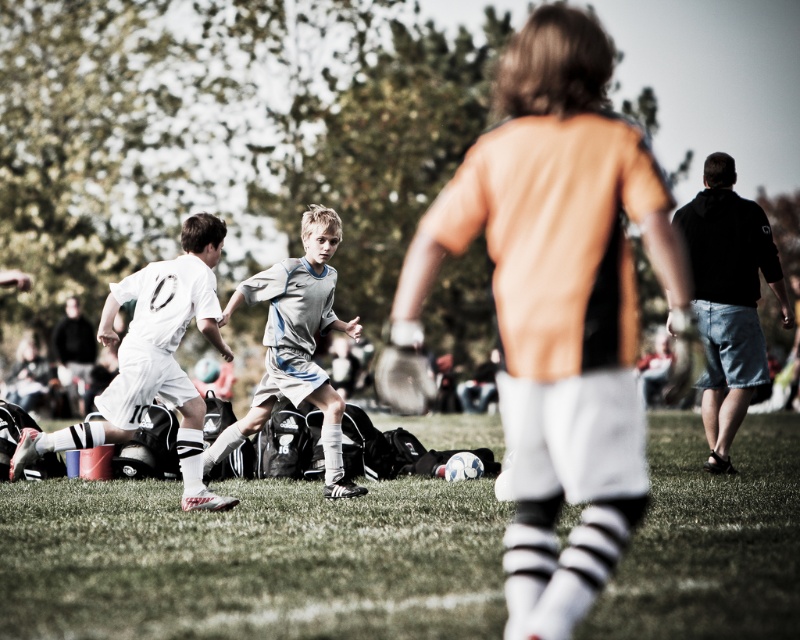
How distant is white matte soccer player at left from dark gray hoodie at left?

white matte soccer player at left and dark gray hoodie at left are 21.39 meters apart from each other.

Between point (172, 323) and point (69, 342), which one is positioned in front?

Positioned in front is point (172, 323).

Measure the distance between point (192, 404) and camera.

Point (192, 404) is 13.72 meters away from camera.

Locate an element on the screen. This screenshot has width=800, height=640. white matte soccer player at left is located at coordinates (154, 358).

This screenshot has height=640, width=800. Describe the element at coordinates (560, 305) in the screenshot. I see `orange matte jersey at center` at that location.

Does orange matte jersey at center have a greater width compared to gray matte soccer jersey at center?

Correct, the width of orange matte jersey at center exceeds that of gray matte soccer jersey at center.

Locate an element on the screen. The image size is (800, 640). orange matte jersey at center is located at coordinates (560, 305).

Looking at this image, between black cotton hoodie at right and dark gray hoodie at left, which one is positioned lower?

dark gray hoodie at left

Does black cotton hoodie at right have a greater width compared to dark gray hoodie at left?

Yes, black cotton hoodie at right is wider than dark gray hoodie at left.

What do you see at coordinates (728, 300) in the screenshot? The image size is (800, 640). I see `black cotton hoodie at right` at bounding box center [728, 300].

Find the location of `black cotton hoodie at right`. black cotton hoodie at right is located at coordinates (728, 300).